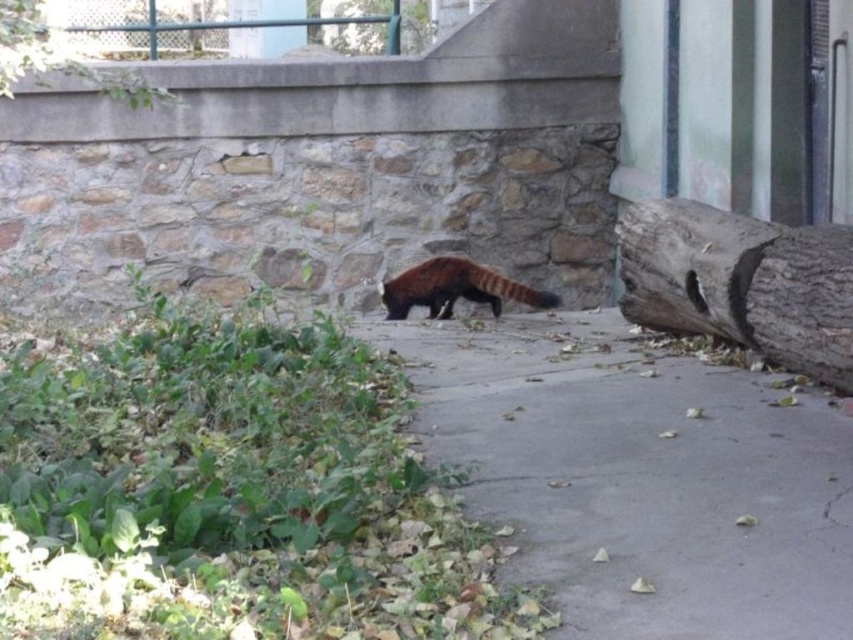
Can you confirm if gray rough bark tree trunk at right is smaller than fluffy reddish-brown animal at center?

No, gray rough bark tree trunk at right is not smaller than fluffy reddish-brown animal at center.

Between point (724, 294) and point (521, 292), which one is positioned in front?

Positioned in front is point (724, 294).

What are the coordinates of `gray rough bark tree trunk at right` in the screenshot? It's located at (741, 282).

Who is lower down, green leafy tree at upper left or brown rough bark tree at upper center?

green leafy tree at upper left

Does point (120, 70) come farther from viewer compared to point (368, 45)?

No, (120, 70) is closer to viewer.

The image size is (853, 640). In order to click on green leafy tree at upper left in this screenshot , I will do `click(57, 58)`.

Is the position of gray concrete pavement at center more distant than that of gray rough bark tree trunk at right?

No, gray concrete pavement at center is in front of gray rough bark tree trunk at right.

Looking at this image, which of these two, gray concrete pavement at center or gray rough bark tree trunk at right, stands taller?

gray rough bark tree trunk at right

Is point (653, 588) behind point (744, 216)?

No.

The image size is (853, 640). In order to click on gray concrete pavement at center in this screenshot , I will do `click(639, 476)`.